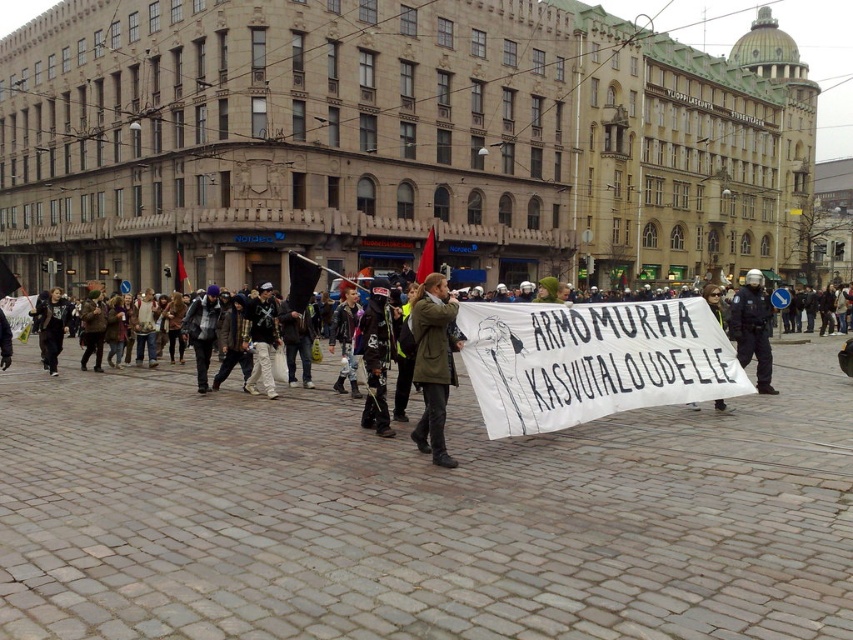
You are a photographer standing at point (433, 364) in the image. What object is directly in front of you?

The green matte coat at center is directly in front of you at point (433, 364).

You are a photographer trying to capture both the green matte coat at center and the matte black helmet at center in a single frame. Given their sizes, which object would you need to position closer to the camera to ensure both fit within the frame?

The green matte coat at center has a lesser width compared to the matte black helmet at center, so you should position the green matte coat at center closer to the camera to ensure both fit within the frame.